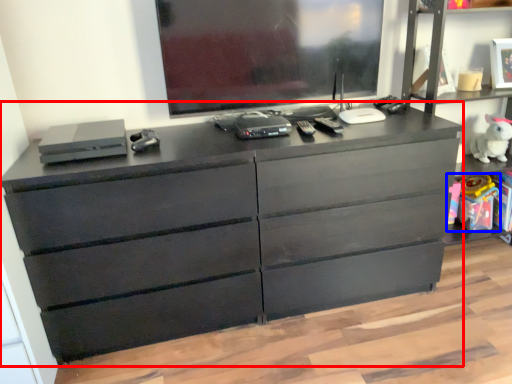
Question: Among these objects, which one is nearest to the camera, chest of drawers (highlighted by a red box) or toy (highlighted by a blue box)?

Choices:
 (A) chest of drawers
 (B) toy

Answer: (A)